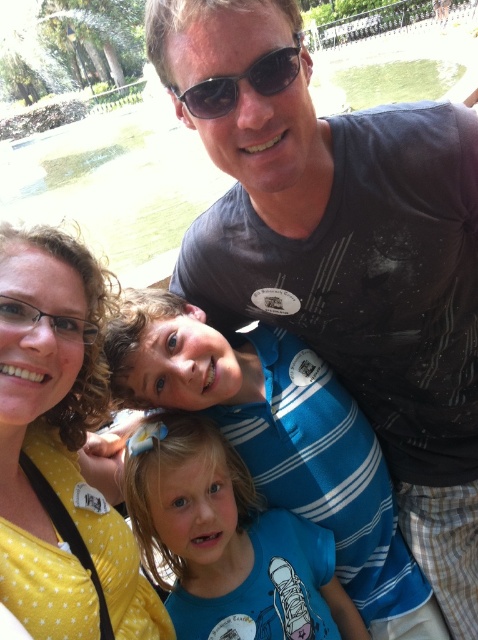
Does dark gray t-shirt at upper center have a greater height compared to yellow dotted shirt at lower left?

In fact, dark gray t-shirt at upper center may be shorter than yellow dotted shirt at lower left.

You are a GUI agent. You are given a task and a screenshot of the screen. Output one action in this format:
    pyautogui.click(x=<x>, y=<y>)
    Task: Click on the dark gray t-shirt at upper center
    The image size is (478, 640).
    Given the screenshot: What is the action you would take?
    pyautogui.click(x=343, y=252)

Identify the location of dark gray t-shirt at upper center. This screenshot has height=640, width=478. (343, 252).

Between dark gray t-shirt at upper center and black reflective sunglasses at upper center, which one is positioned higher?

black reflective sunglasses at upper center

Does point (238, 32) come in front of point (273, 81)?

Yes.

Locate an element on the screen. This screenshot has width=478, height=640. dark gray t-shirt at upper center is located at coordinates tap(343, 252).

Where is `dark gray t-shirt at upper center`? dark gray t-shirt at upper center is located at coordinates (343, 252).

Does dark gray t-shirt at upper center have a larger size compared to blue striped shirt at center?

No.

Who is more distant from viewer, (203, 216) or (414, 600)?

The point (203, 216) is more distant.

Which is behind, point (304, 180) or point (317, 385)?

The point (317, 385) is more distant.

Find the location of `dark gray t-shirt at upper center`. dark gray t-shirt at upper center is located at coordinates (343, 252).